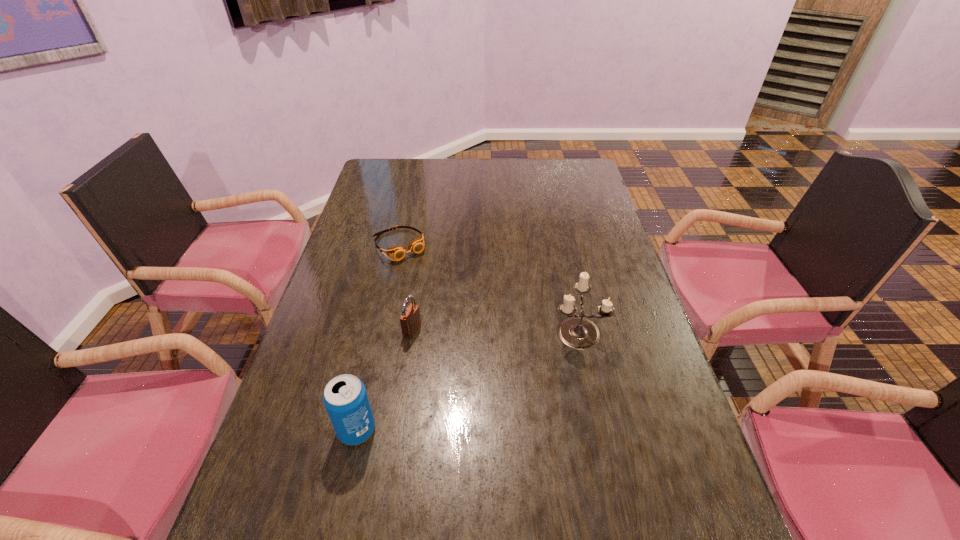
Select which object is the closest to the candle holder. Please provide its 2D coordinates. Your answer should be formatted as a tuple, i.e. [(x, y)], where the tuple contains the x and y coordinates of a point satisfying the conditions above.

[(410, 320)]

This screenshot has height=540, width=960. I want to click on object that is the third nearest to the third tallest object, so click(x=576, y=332).

Find the location of a particular element. free space that satisfies the following two spatial constraints: 1. on the front side of the padlock; 2. on the right side of the rightmost object is located at coordinates (412, 330).

At what (x,y) coordinates should I click in order to perform the action: click on free space that satisfies the following two spatial constraints: 1. on the back side of the farthest object; 2. on the right side of the nearest object. Please return your answer as a coordinate pair (x, y). The height and width of the screenshot is (540, 960). Looking at the image, I should click on (398, 245).

What are the coordinates of `vacant space that satisfies the following two spatial constraints: 1. on the back side of the farthest object; 2. on the right side of the soda can` in the screenshot? It's located at (398, 245).